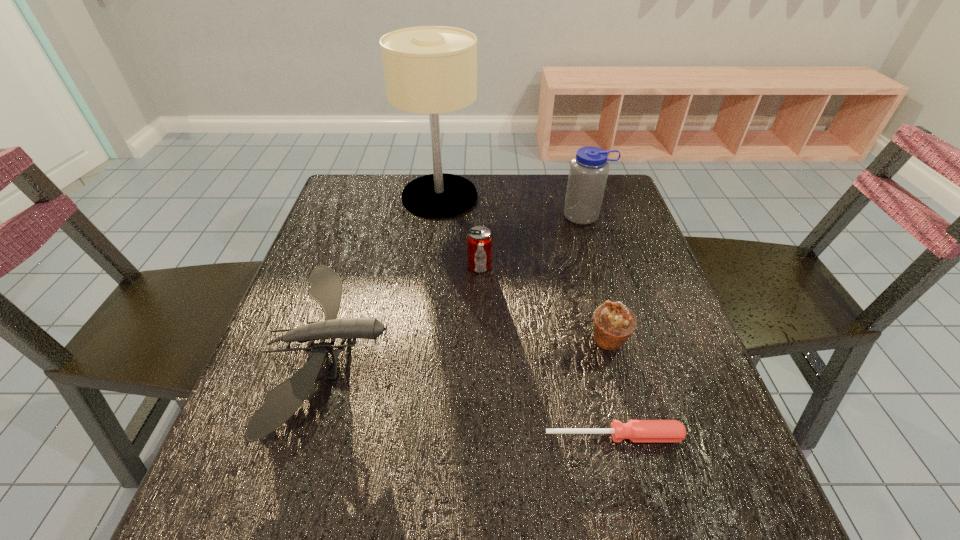
Find the location of a particular element. vacant space located 0.090m at the head of the drone is located at coordinates (434, 349).

Locate an element on the screen. free region located 0.080m on the front of the shortest object is located at coordinates (628, 494).

Find the location of a particular element. The image size is (960, 540). table lamp located in the far edge section of the desktop is located at coordinates (428, 69).

The image size is (960, 540). Find the location of `water bottle present at the far edge`. water bottle present at the far edge is located at coordinates 588,173.

Find the location of a particular element. object that is at the left edge is located at coordinates [285, 399].

Where is `water bottle present at the right edge`? This screenshot has height=540, width=960. water bottle present at the right edge is located at coordinates (588, 173).

You are a GUI agent. You are given a task and a screenshot of the screen. Output one action in this format:
    pyautogui.click(x=<x>, y=<y>)
    Task: Click on the muffin present at the right edge
    
    Given the screenshot: What is the action you would take?
    pyautogui.click(x=613, y=324)

The height and width of the screenshot is (540, 960). I want to click on screwdriver that is at the right edge, so (x=635, y=430).

Find the location of a particular element. The height and width of the screenshot is (540, 960). object positioned at the far right corner is located at coordinates (588, 173).

The height and width of the screenshot is (540, 960). What are the coordinates of `free space at the far edge` in the screenshot? It's located at (478, 207).